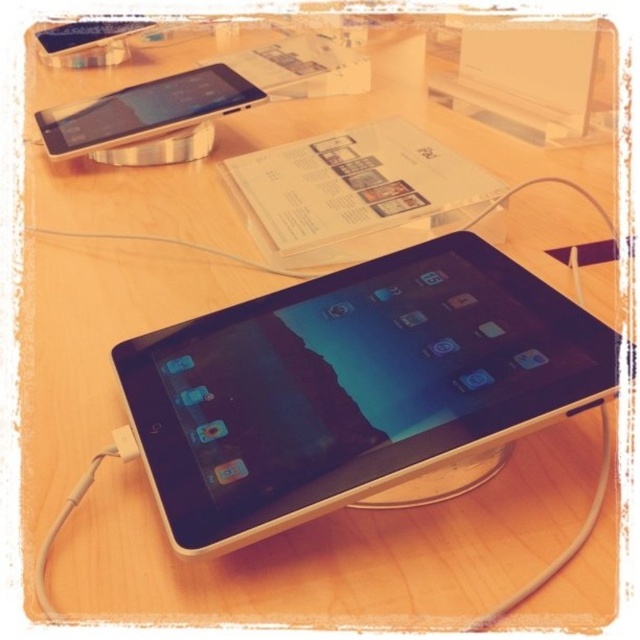
You are a customer at an electronics store and want to know which device is closer to the entrance. The entrance is located to the left side of the store. You see the black glossy tablet at center and the satin silver ipod at upper left. Based on their positions, which device is closer to the entrance?

The satin silver ipod at upper left is closer to the entrance because it is positioned to the left of the black glossy tablet at center, and the entrance is on the left side of the store.